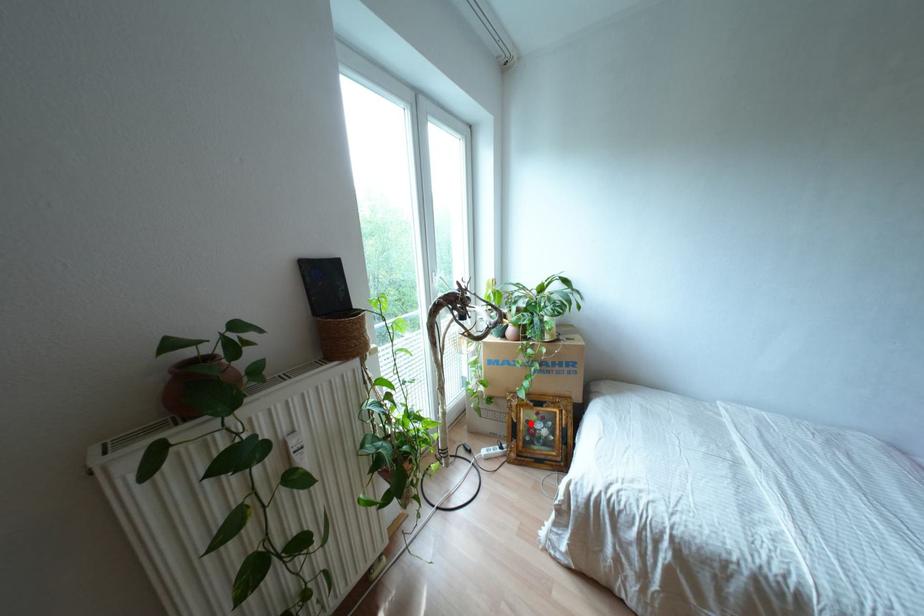
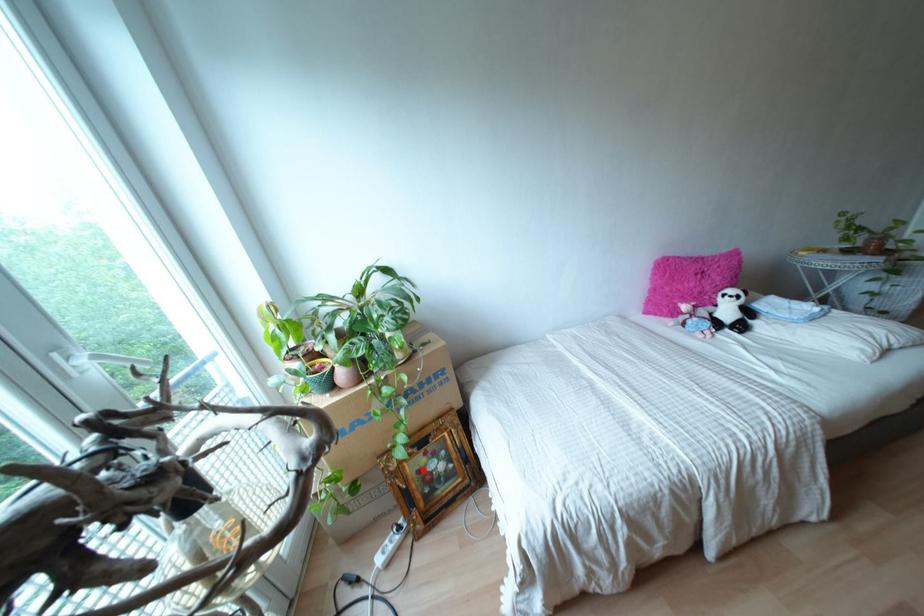
I am providing you with two images of the same scene from different viewpoints. A red point is marked on the first image and another point is marked on the second image. Are the points marked in image1 and image2 representing the same 3D position?

Yes